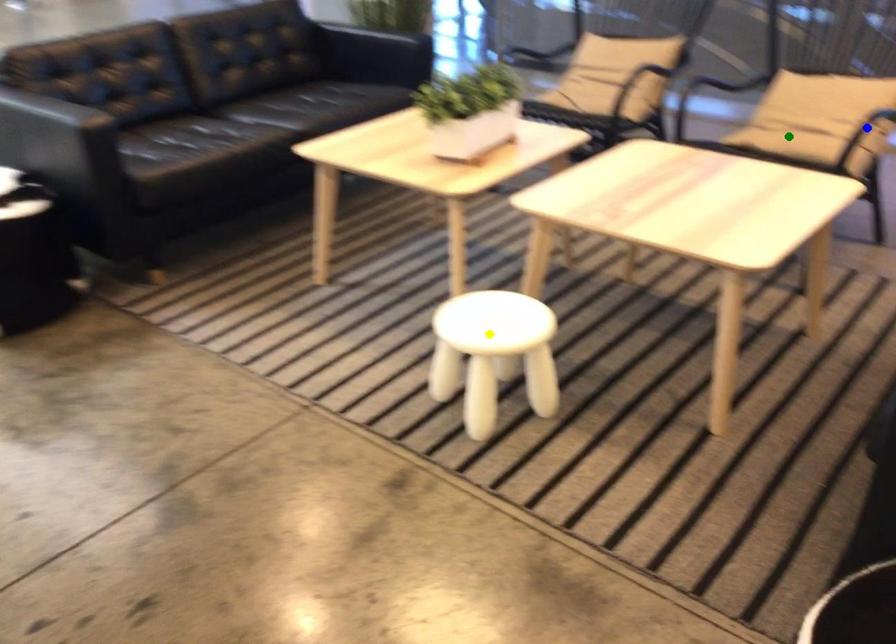
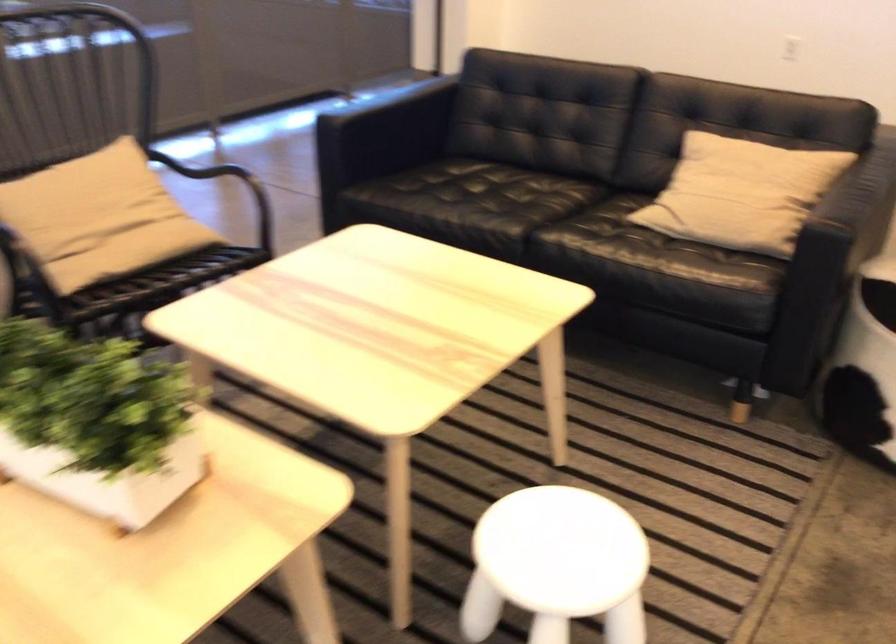
I am providing you with two images of the same scene from different viewpoints. Three points are marked in image1. Which point corresponds to a part or object that is occluded in image2?In image1, three points are marked. Which of them correspond to a part or object that is occluded in image2?Among the three points shown in image1, which one corresponds to a part or object that is no longer visible due to occlusion in image2?

Invisible in image2: blue point.